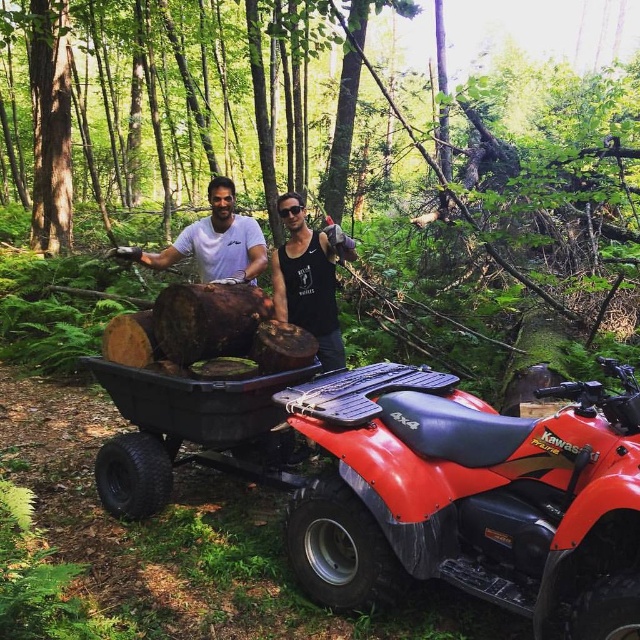
You are a hiker who wants to take a photo of both the black matte tank top at center and the white matte shirt at center in the same frame. Which direction should you move to ensure both are visible?

The black matte tank top at center is to the right of the white matte shirt at center, so you should move to the left to ensure both are visible in your photo.

Consider the image. You are a park ranger assessing the scene. You need to determine if the black plastic wagon at center can carry the smooth wood logs at center. Based on their sizes, what do you conclude?

The smooth wood logs at center are taller than the black plastic wagon at center, so the wagon may not be able to carry them without the logs exceeding the wagon height, potentially causing instability or safety issues.